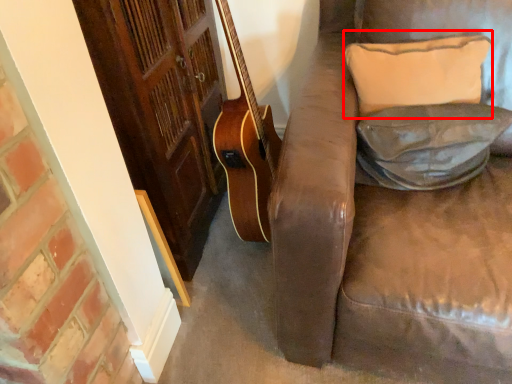
Question: In this image, where is pillow (annotated by the red box) located relative to pillow?

Choices:
 (A) right
 (B) left

Answer: (B)